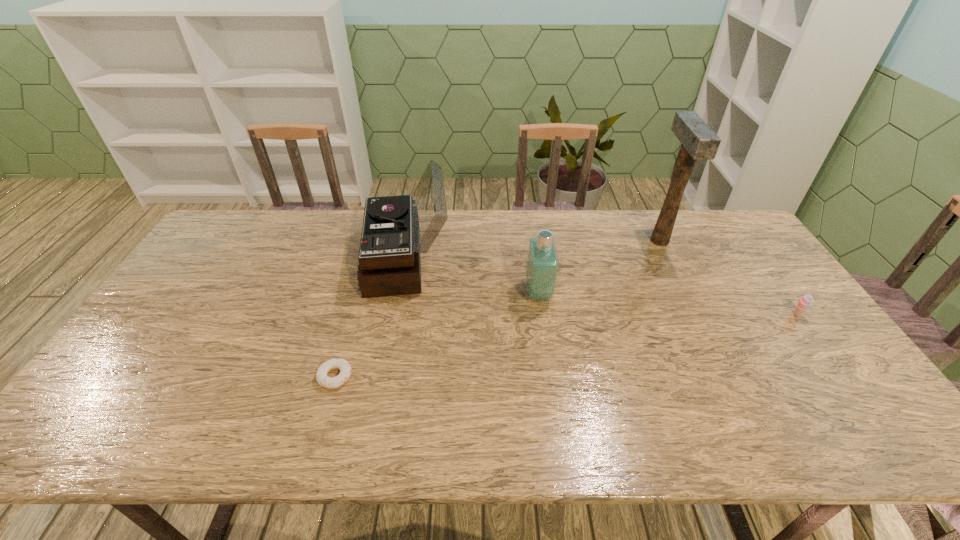
At what (x,y) coordinates should I click in order to perform the action: click on vacant space in between the record player and the third tallest object. Please return your answer as a coordinate pair (x, y). The width and height of the screenshot is (960, 540). Looking at the image, I should click on (472, 277).

You are a GUI agent. You are given a task and a screenshot of the screen. Output one action in this format:
    pyautogui.click(x=<x>, y=<y>)
    Task: Click on the vacant space that's between the doughnut and the fourth farthest object
    
    Given the screenshot: What is the action you would take?
    pyautogui.click(x=566, y=346)

This screenshot has width=960, height=540. I want to click on vacant area between the record player and the nearest object, so click(371, 319).

What are the coordinates of `free point between the rightmost object and the perfume` in the screenshot? It's located at (667, 304).

You are a GUI agent. You are given a task and a screenshot of the screen. Output one action in this format:
    pyautogui.click(x=<x>, y=<y>)
    Task: Click on the object that is the closest to the third object from left to right
    This screenshot has height=540, width=960.
    Given the screenshot: What is the action you would take?
    pyautogui.click(x=396, y=229)

Locate an element on the screen. the third closest object to the shortest object is located at coordinates (699, 142).

At what (x,y) coordinates should I click in order to perform the action: click on free point that satisfies the following two spatial constraints: 1. on the back side of the nearest object; 2. on the left side of the record player. Please return your answer as a coordinate pair (x, y). The height and width of the screenshot is (540, 960). Looking at the image, I should click on (369, 261).

You are a GUI agent. You are given a task and a screenshot of the screen. Output one action in this format:
    pyautogui.click(x=<x>, y=<y>)
    Task: Click on the free space in the image that satisfies the following two spatial constraints: 1. on the back side of the second object from right to left; 2. on the left side of the doughnut
    Image resolution: width=960 pixels, height=540 pixels.
    Given the screenshot: What is the action you would take?
    pyautogui.click(x=374, y=240)

Where is `vacant region that satisfies the following two spatial constraints: 1. on the front side of the rightmost object; 2. on the left side of the tallest object`? The width and height of the screenshot is (960, 540). vacant region that satisfies the following two spatial constraints: 1. on the front side of the rightmost object; 2. on the left side of the tallest object is located at coordinates (696, 315).

Locate an element on the screen. free spot that satisfies the following two spatial constraints: 1. on the front label of the perfume; 2. on the back side of the fourth farthest object is located at coordinates 541,315.